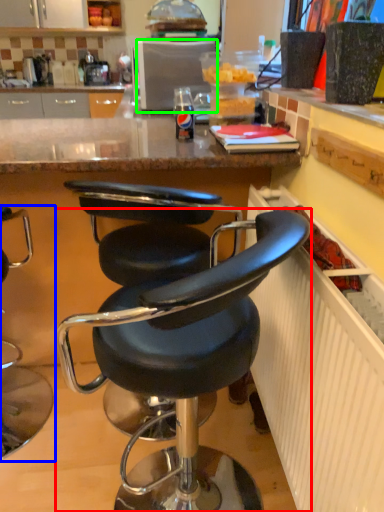
Question: Which object is the closest to the chair (highlighted by a red box)? Choose among these: chair (highlighted by a blue box) or appliance (highlighted by a green box).

Choices:
 (A) chair
 (B) appliance

Answer: (A)